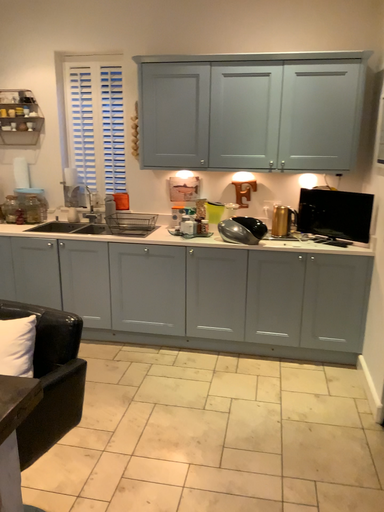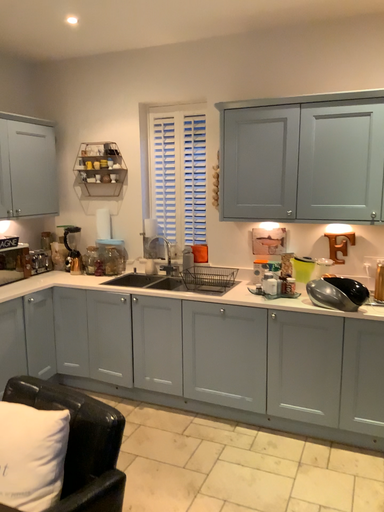
Question: Which way did the camera rotate in the video?

Choices:
 (A) rotated left
 (B) rotated right

Answer: (A)